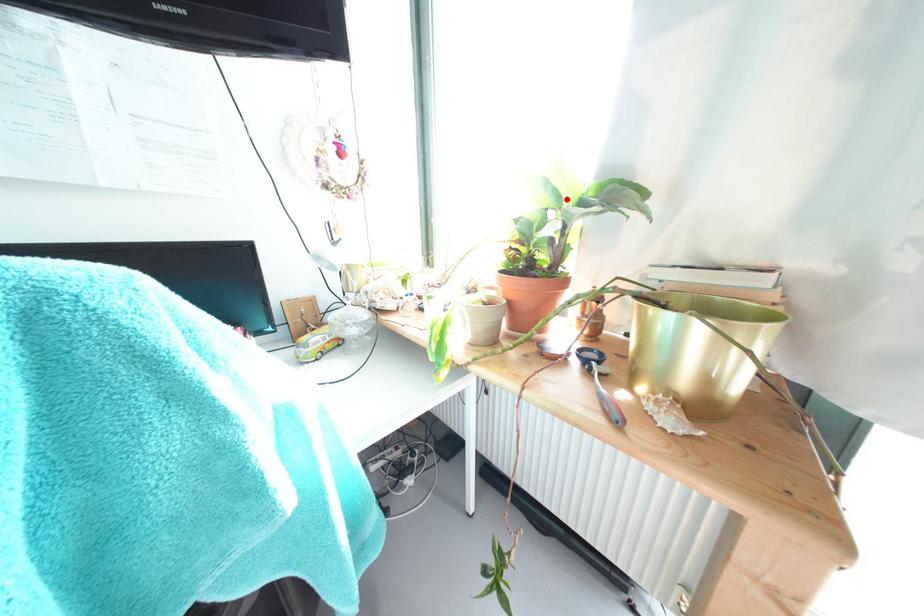
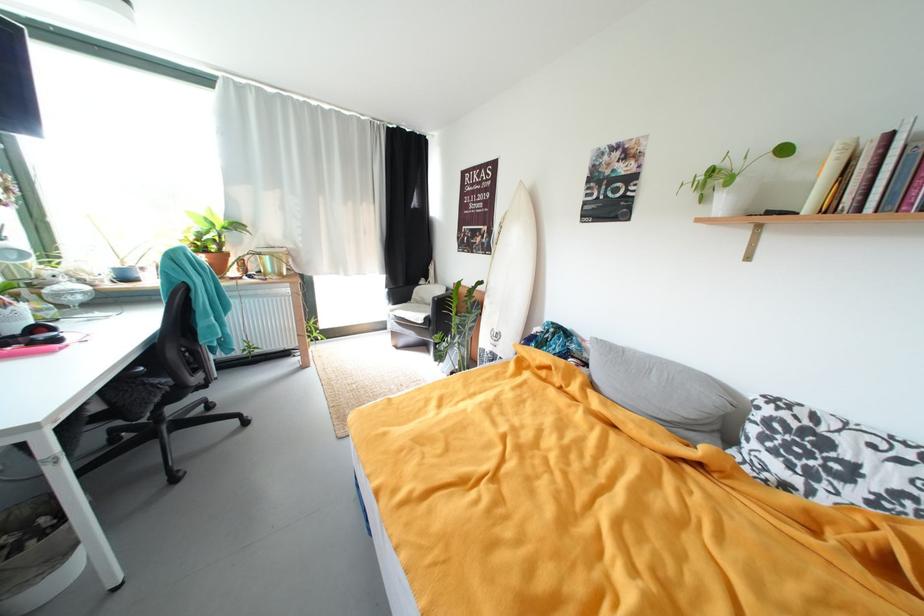
Locate, in the second image, the point that corresponds to the highlighted location in the first image.

(221, 225)